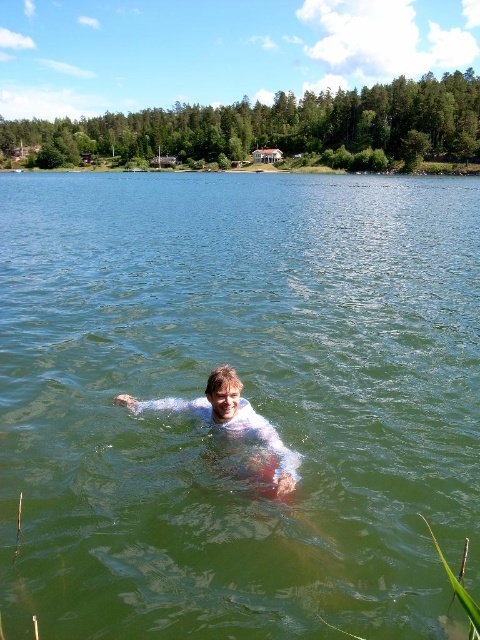
Question: Which of the following is the closest to the observer?

Choices:
 (A) (219, 413)
 (B) (167, 179)

Answer: (A)

Question: Does green liquid water at center appear under white matte skin at center?

Choices:
 (A) no
 (B) yes

Answer: (A)

Question: Is green liquid water at center smaller than white matte skin at center?

Choices:
 (A) no
 (B) yes

Answer: (A)

Question: Is green liquid water at center thinner than white matte skin at center?

Choices:
 (A) no
 (B) yes

Answer: (A)

Question: Which point is farther from the camera taking this photo?

Choices:
 (A) (286, 452)
 (B) (391, 634)

Answer: (A)